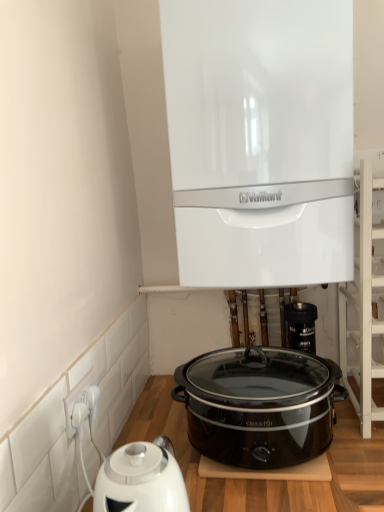
Question: Is point (274, 163) positioned closer to the camera than point (99, 392)?

Choices:
 (A) farther
 (B) closer

Answer: (A)

Question: Considering the positions of white glossy boiler at upper center and white plastic socket at lower left in the image, is white glossy boiler at upper center bigger or smaller than white plastic socket at lower left?

Choices:
 (A) big
 (B) small

Answer: (A)

Question: Estimate the real-world distances between objects in this image. Which object is farther from the white wooden shelf at upper right?

Choices:
 (A) black plastic table at lower center
 (B) white glossy boiler at upper center
 (C) white plastic socket at lower left
 (D) black plastic valve at lower center
 (E) black glossy slow cooker at center

Answer: (C)

Question: Which is farther from the black plastic table at lower center?

Choices:
 (A) black glossy slow cooker at center
 (B) white wooden shelf at upper right
 (C) white glossy boiler at upper center
 (D) white plastic socket at lower left
 (E) black plastic valve at lower center

Answer: (C)